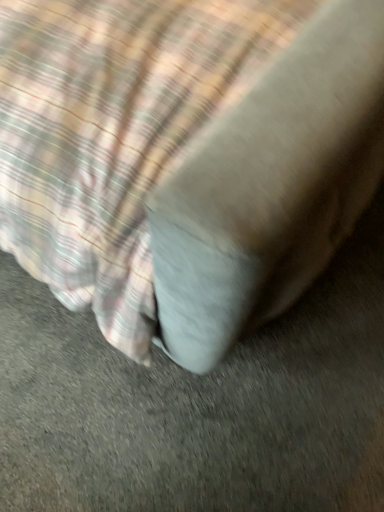
Describe the element at coordinates (186, 157) in the screenshot. This screenshot has width=384, height=512. I see `gray fabric bed at lower right` at that location.

Where is `gray fabric bed at lower right`? The image size is (384, 512). gray fabric bed at lower right is located at coordinates (186, 157).

The width and height of the screenshot is (384, 512). I want to click on gray fabric bed at lower right, so click(x=186, y=157).